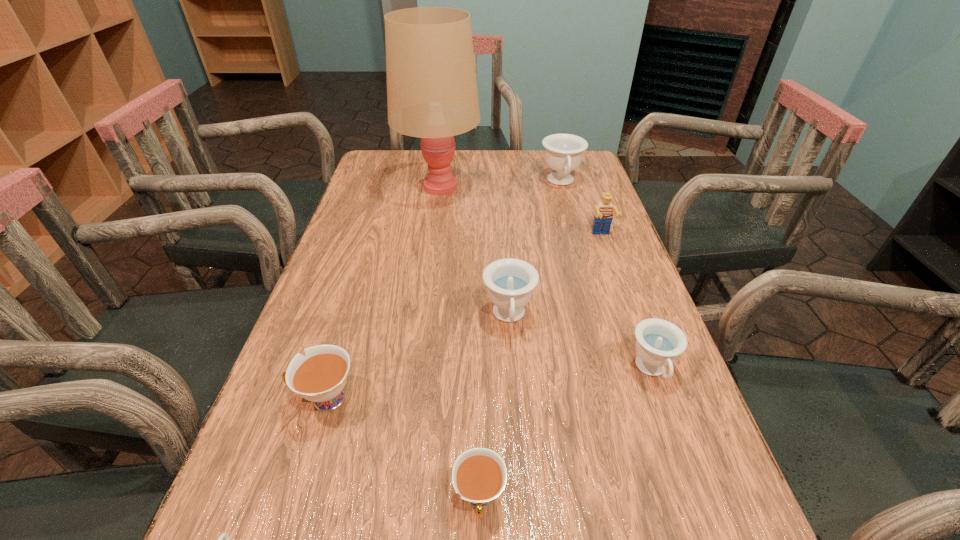
Where is `vacant space that is in between the bigger white teacup and the pink lampshade`? Image resolution: width=960 pixels, height=540 pixels. vacant space that is in between the bigger white teacup and the pink lampshade is located at coordinates (382, 293).

I want to click on vacant area that lies between the third farthest object and the lampshade, so click(x=520, y=211).

Locate an element on the screen. free spot between the tallest object and the second farthest blue teacup is located at coordinates (474, 252).

I want to click on free space between the fifth nearest object and the tallest teacup, so click(x=535, y=249).

Locate an element on the screen. The image size is (960, 540). vacant area between the right white teacup and the fifth nearest object is located at coordinates (494, 408).

Identify the location of vacant space that is in between the pink lampshade and the smaller white teacup. The image size is (960, 540). (459, 342).

Where is `object that is the closest to the blue Lego`? The width and height of the screenshot is (960, 540). object that is the closest to the blue Lego is located at coordinates (563, 152).

Locate which object is the seventh closest to the third farthest object. Please provide its 2D coordinates. Your answer should be formatted as a tuple, i.e. [(x, y)], where the tuple contains the x and y coordinates of a point satisfying the conditions above.

[(224, 535)]

Identify the location of teacup that is the second closest one to the nearest object. This screenshot has width=960, height=540. (479, 475).

Select which teacup appears as the fourth closest to the second nearest blue teacup. Please provide its 2D coordinates. Your answer should be formatted as a tuple, i.e. [(x, y)], where the tuple contains the x and y coordinates of a point satisfying the conditions above.

[(563, 152)]